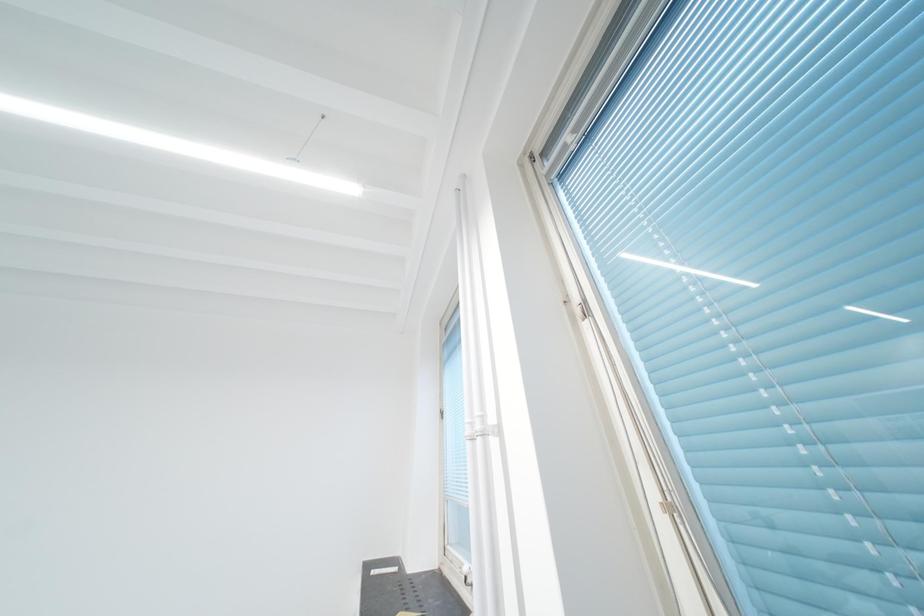
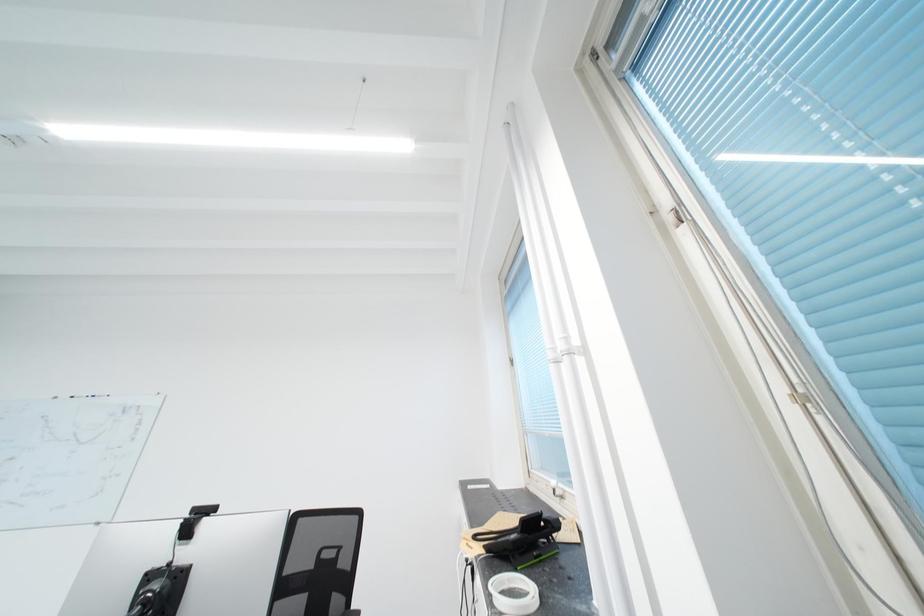
Question: Based on the continuous images, in which direction is the camera rotating? Reply with the corresponding letter.

Choices:
 (A) Left
 (B) Right
 (C) Up
 (D) Down

Answer: (A)